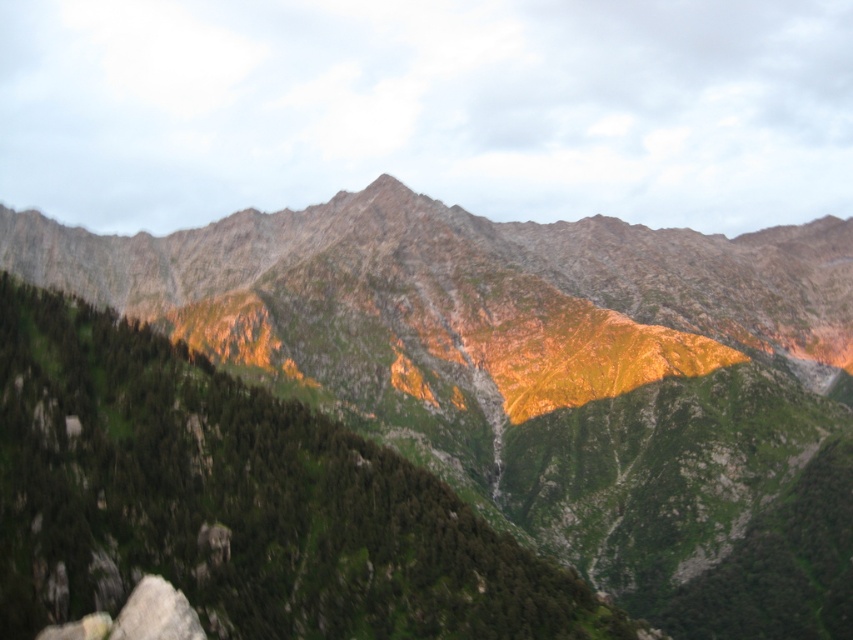
You are a photographer standing at the base of the mountain. You want to capture a closeup shot of the green rocky mountain range at center. Given that your camera can focus on objects up to 50 meters away, will you be able to take the closeup shot without moving closer?

The green rocky mountain range at center is 84.78 meters away from the camera. Since your camera can only focus up to 50 meters, you will not be able to take a closeup shot without moving closer.

You are a hiker planning to take a photo of the green rocky mountain range at center and the smooth gray rock at lower left. Which object should you focus on first if you want to capture both in a single frame without moving the camera?

The green rocky mountain range at center is larger in size than the smooth gray rock at lower left, so you should focus on the green rocky mountain range at center first to ensure it fills the frame appropriately before adjusting for the smaller smooth gray rock at lower left.

You are a hiker planning to climb both the green rocky mountain range at center and the smooth gray rock at lower left. Which one will require more effort due to its height?

The green rocky mountain range at center requires more effort because it has a greater height compared to the smooth gray rock at lower left.